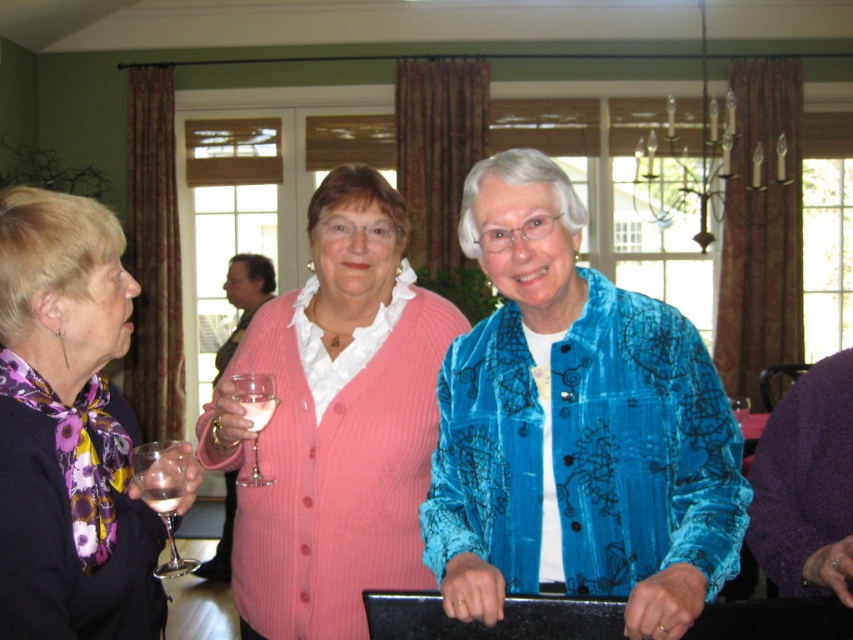
Question: Among these points, which one is nearest to the camera?

Choices:
 (A) (172, 540)
 (B) (418, 464)

Answer: (A)

Question: Among these points, which one is farthest from the camera?

Choices:
 (A) (270, 406)
 (B) (62, 548)
 (C) (177, 500)

Answer: (A)

Question: Does clear glass wine glass at lower left have a lesser width compared to clear glass wine at center?

Choices:
 (A) no
 (B) yes

Answer: (A)

Question: Which of these objects is positioned farthest from the clear glass wine glass at center?

Choices:
 (A) clear glass wine glass at lower left
 (B) floral scarf at left
 (C) translucent glass wine at center

Answer: (B)

Question: Does velvet blue jacket at center appear over clear glass wine glass at lower left?

Choices:
 (A) yes
 (B) no

Answer: (A)

Question: Is pink ribbed sweater at center closer to the viewer compared to floral scarf at left?

Choices:
 (A) yes
 (B) no

Answer: (B)